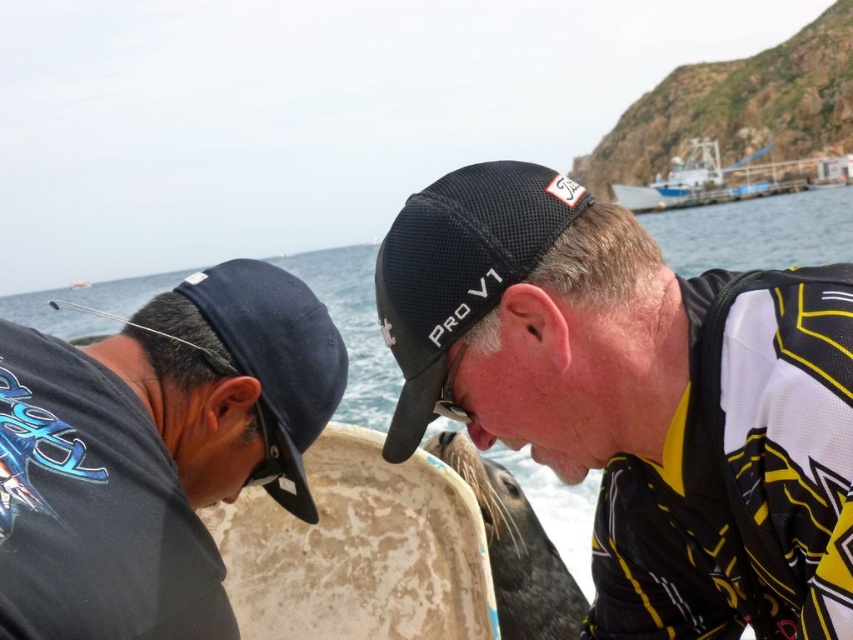
You are a photographer trying to capture both the black mesh cap at upper center and the black mesh cap at center in the same frame. Based on their positions, which cap should you focus on first to ensure both are in the frame?

The black mesh cap at upper center is in front of the black mesh cap at center, so you should focus on the black mesh cap at center first to ensure both are visible in the frame.

You are standing at the point marked as point (569, 378). What object is located exactly at this point?

The black mesh cap at upper center is located exactly at point (569, 378).